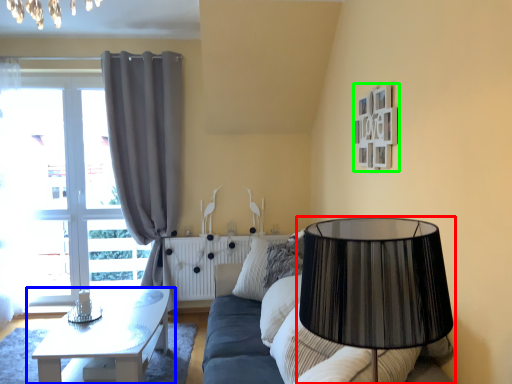
Question: Which is farther away from lamp (highlighted by a red box)? table (highlighted by a blue box) or picture frame (highlighted by a green box)?

Choices:
 (A) table
 (B) picture frame

Answer: (A)